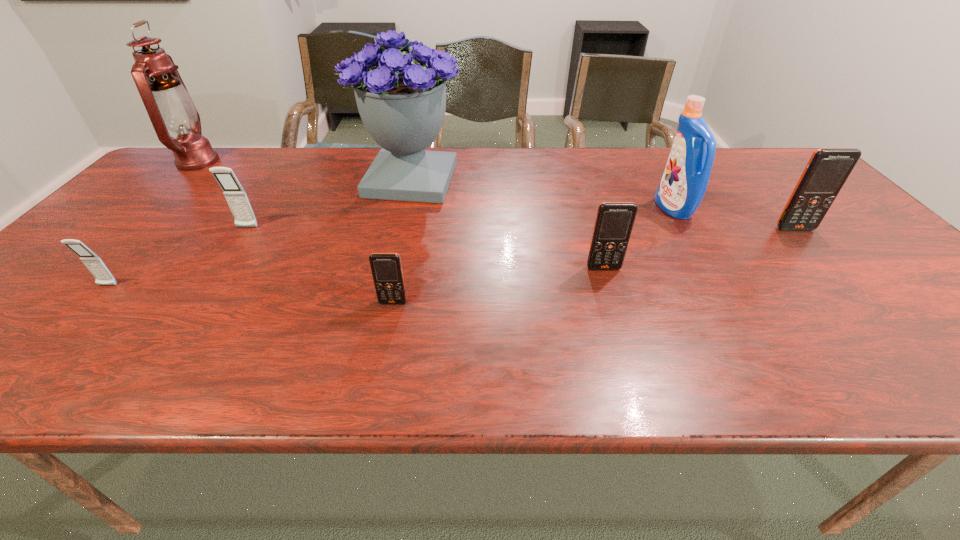
Identify the location of vacant space that's between the purple bouquet and the red oil lamp. (304, 171).

This screenshot has height=540, width=960. What are the coordinates of `blank region between the farthest orange cellular telephone and the sixth shortest object` in the screenshot? It's located at (734, 219).

The height and width of the screenshot is (540, 960). In order to click on vacant area that lies between the right gray cellular telephone and the leftmost orange cellular telephone in this screenshot , I will do `click(320, 265)`.

Image resolution: width=960 pixels, height=540 pixels. I want to click on empty space between the smallest orange cellular telephone and the red oil lamp, so click(x=296, y=232).

Locate an element on the screen. The image size is (960, 540). empty space that is in between the second cellular telephone from left to right and the sixth shortest object is located at coordinates (461, 218).

Point out which object is positioned as the seventh nearest to the rightmost orange cellular telephone. Please provide its 2D coordinates. Your answer should be formatted as a tuple, i.e. [(x, y)], where the tuple contains the x and y coordinates of a point satisfying the conditions above.

[(170, 107)]

Select which object is the fifth closest to the farther gray cellular telephone. Please provide its 2D coordinates. Your answer should be formatted as a tuple, i.e. [(x, y)], where the tuple contains the x and y coordinates of a point satisfying the conditions above.

[(614, 221)]

Choose which cellular telephone is the third nearest neighbor to the second cellular telephone from right to left. Please provide its 2D coordinates. Your answer should be formatted as a tuple, i.e. [(x, y)], where the tuple contains the x and y coordinates of a point satisfying the conditions above.

[(235, 195)]

Identify which cellular telephone is located as the nearest to the seventh farthest object. Please provide its 2D coordinates. Your answer should be formatted as a tuple, i.e. [(x, y)], where the tuple contains the x and y coordinates of a point satisfying the conditions above.

[(235, 195)]

Select which orange cellular telephone is the closest to the bigger gray cellular telephone. Please provide its 2D coordinates. Your answer should be formatted as a tuple, i.e. [(x, y)], where the tuple contains the x and y coordinates of a point satisfying the conditions above.

[(386, 268)]